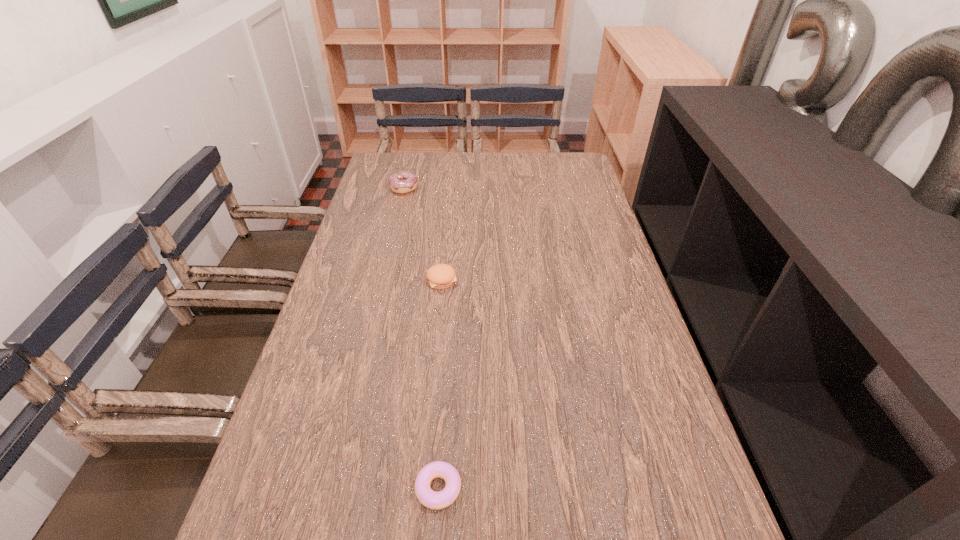
I want to click on the left doughnut, so click(x=403, y=182).

Where is `the tallest object`? the tallest object is located at coordinates (403, 182).

Locate an element on the screen. the second shortest object is located at coordinates (440, 276).

Where is `patty`? This screenshot has height=540, width=960. patty is located at coordinates (440, 276).

The image size is (960, 540). I want to click on the right doughnut, so click(434, 500).

At what (x,y) coordinates should I click in order to perform the action: click on the nearest object. Please return your answer as a coordinate pair (x, y). This screenshot has width=960, height=540. Looking at the image, I should click on (434, 500).

The height and width of the screenshot is (540, 960). In order to click on vacant area located 0.210m on the front of the left doughnut in this screenshot , I will do `click(393, 231)`.

Find the location of a particular element. vacant space located 0.330m on the front of the patty is located at coordinates (430, 397).

The image size is (960, 540). In order to click on free spot located 0.200m on the back of the nearer doughnut in this screenshot , I will do (x=446, y=377).

The width and height of the screenshot is (960, 540). Find the location of `object positioned at the far edge`. object positioned at the far edge is located at coordinates pos(403,182).